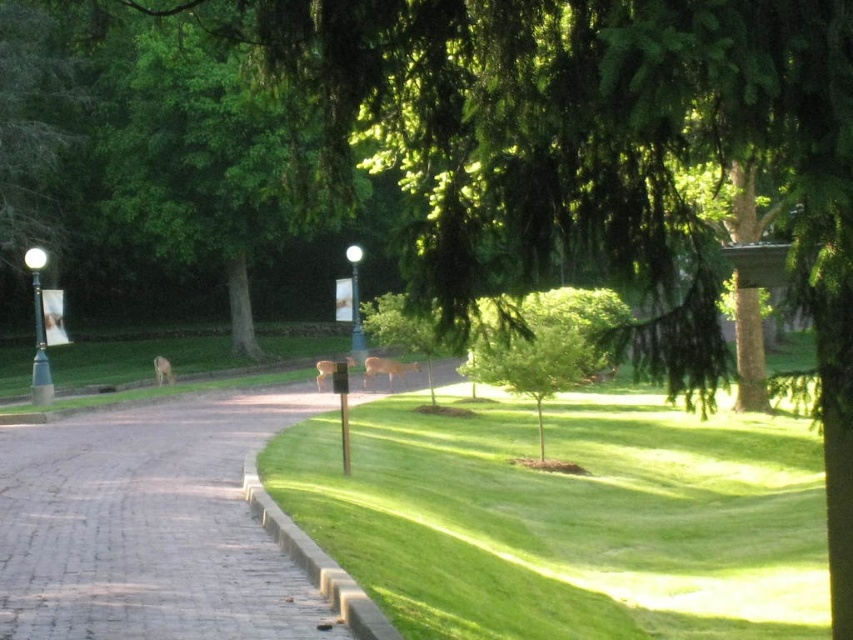
From the picture: You are a park visitor standing at the entrance of the park and see the green grass at center and the green metallic pole at left. Which object is positioned to the right of the other?

The green grass at center is positioned to the right of the green metallic pole at left.

You are a park visitor who wants to take a photo of both the green leafy tree at center and the white glossy lamp post at center. Which object will appear larger in your photo?

The green leafy tree at center will appear larger in the photo because it is bigger than the white glossy lamp post at center.

You are standing at the starting point of the brick path in the park. You see two points marked in the scene. Which point is closer to you, point (489,369) or point (363,342)?

Point (489,369) is in front of point (363,342), so it is closer to you.